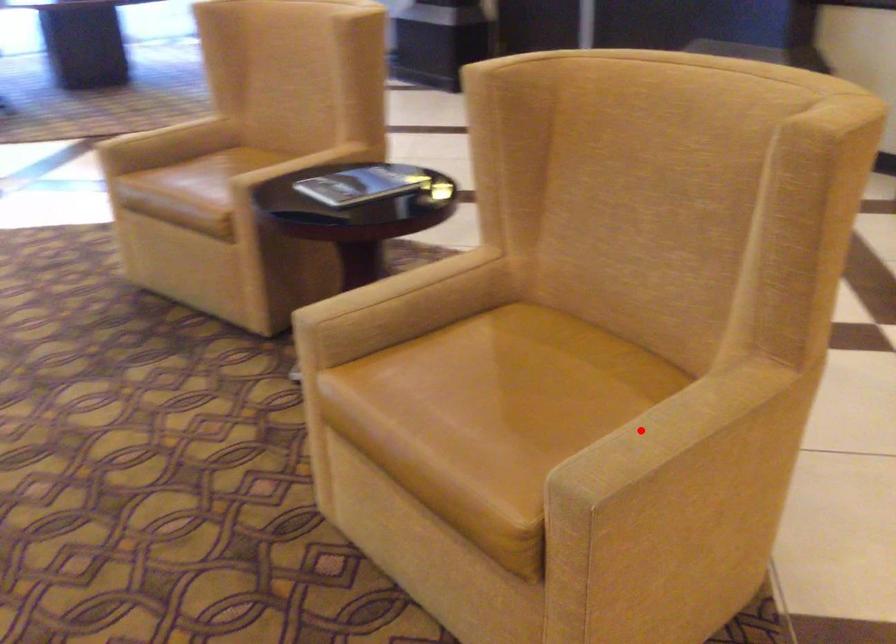
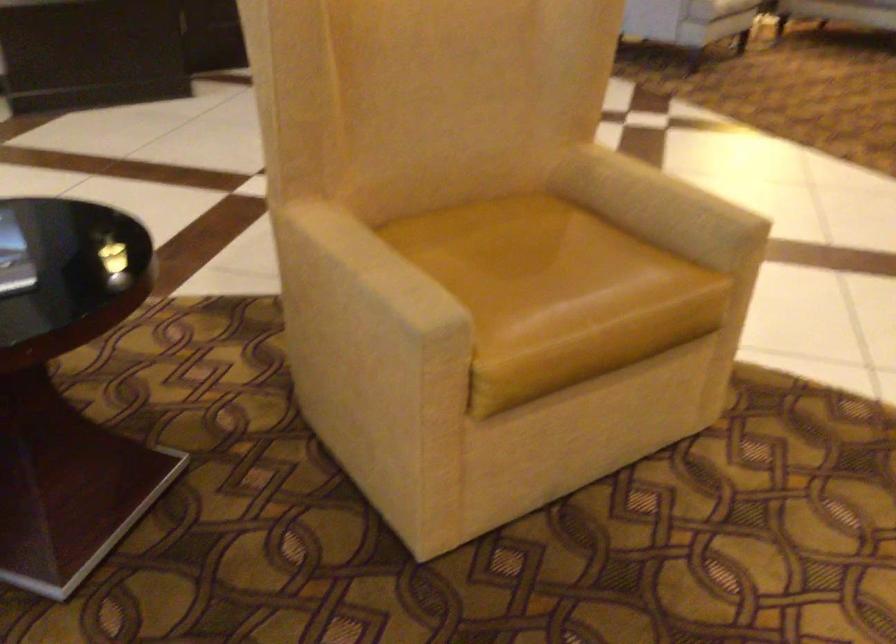
Question: I am providing you with two images of the same scene from different viewpoints. In image1, a red point is highlighted. Considering the same 3D point in image2, which of the following is correct?

Choices:
 (A) It is closer
 (B) It is farther

Answer: (B)